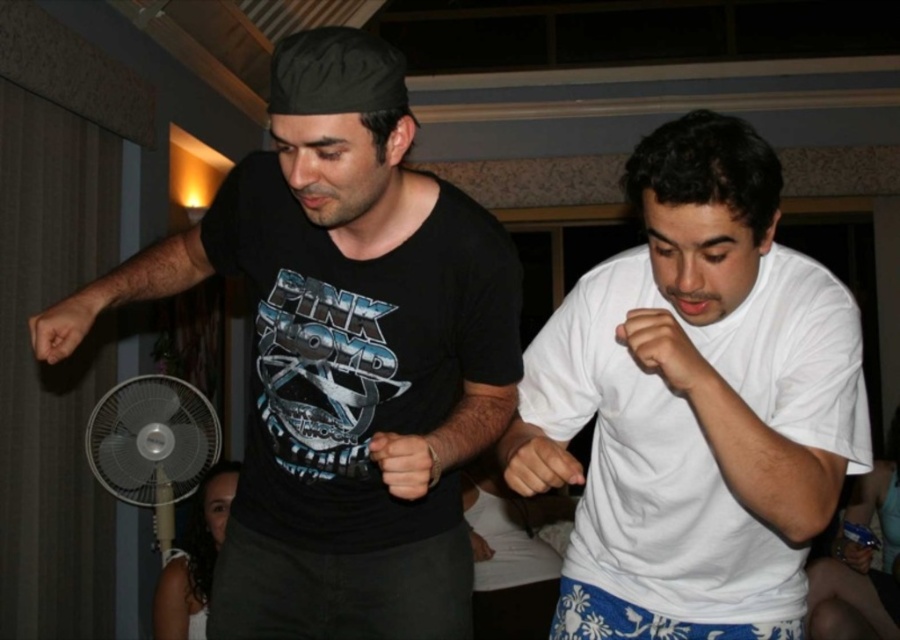
In the scene shown: Is black matte t-shirt at left thinner than white cotton shirt at center?

In fact, black matte t-shirt at left might be wider than white cotton shirt at center.

Can you confirm if black matte t-shirt at left is shorter than white cotton shirt at center?

In fact, black matte t-shirt at left may be taller than white cotton shirt at center.

Locate an element on the screen. black matte t-shirt at left is located at coordinates (344, 355).

Is point (266, 465) positioned in front of point (506, 301)?

No.

Where is `black matte t-shirt at left`? black matte t-shirt at left is located at coordinates (344, 355).

Find the location of a particular element. Image resolution: width=900 pixels, height=640 pixels. black matte t-shirt at left is located at coordinates (344, 355).

Who is more distant from viewer, (x=759, y=566) or (x=516, y=307)?

The point (x=759, y=566) is behind.

Find the location of `white cotton shirt at center`. white cotton shirt at center is located at coordinates (694, 403).

Locate an element on the screen. The height and width of the screenshot is (640, 900). white cotton shirt at center is located at coordinates (x=694, y=403).